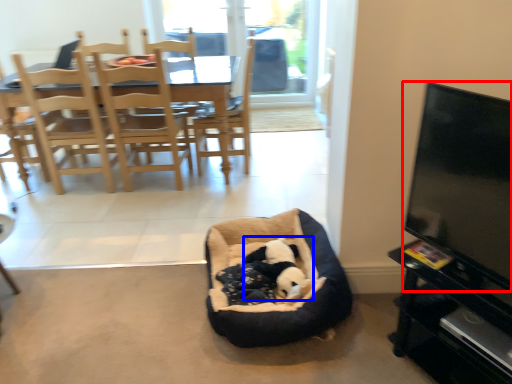
Question: Which point is closer to the camera, television (highlighted by a red box) or animal (highlighted by a blue box)?

Choices:
 (A) television
 (B) animal

Answer: (A)